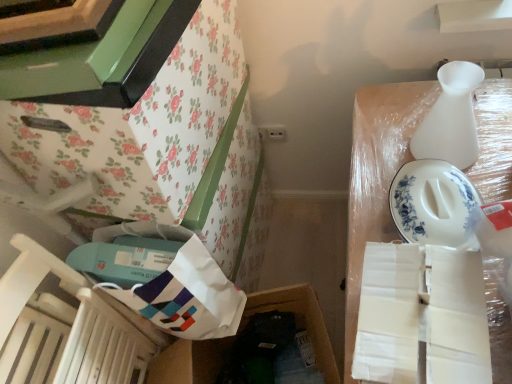
Find the location of a particular element. The height and width of the screenshot is (384, 512). vacant space situated on the left part of white matte vase at upper right is located at coordinates (379, 168).